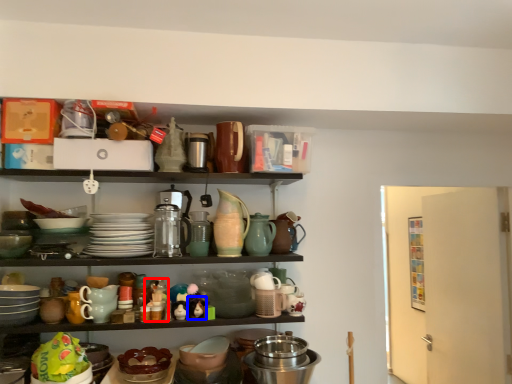
Question: Which point is closer to the camera, toy (highlighted by a red box) or toy (highlighted by a blue box)?

Choices:
 (A) toy
 (B) toy

Answer: (B)